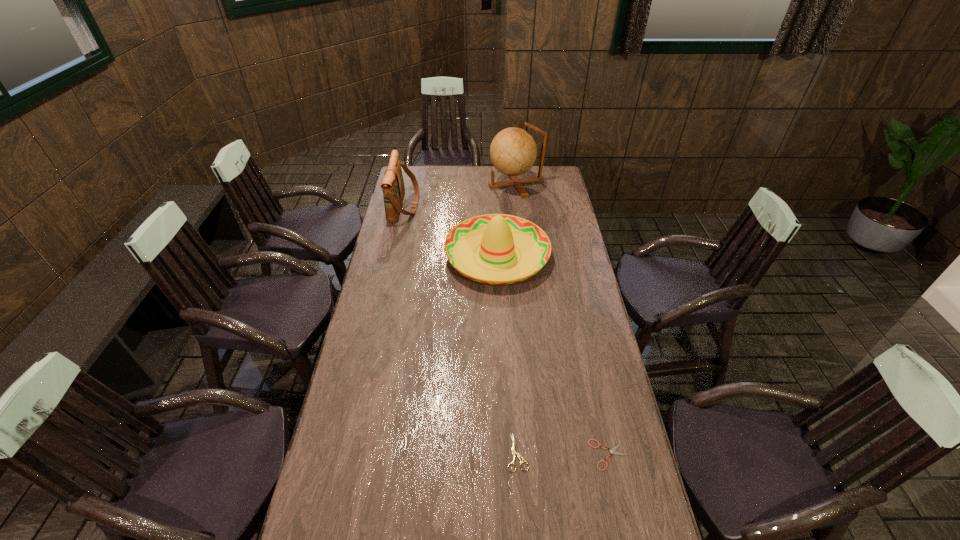
You are a GUI agent. You are given a task and a screenshot of the screen. Output one action in this format:
    pyautogui.click(x=<x>, y=<y>)
    Task: Click on the free point located on the front-facing side of the shoulder bag
    
    Given the screenshot: What is the action you would take?
    pyautogui.click(x=468, y=205)

Find the location of a particular element. The height and width of the screenshot is (540, 960). vacant space situated 0.100m on the right of the sombrero is located at coordinates (571, 255).

This screenshot has width=960, height=540. In order to click on free space located 0.140m on the front of the left shears in this screenshot , I will do `click(522, 526)`.

You are a GUI agent. You are given a task and a screenshot of the screen. Output one action in this format:
    pyautogui.click(x=<x>, y=<y>)
    Task: Click on the vacant space positioned 0.110m on the front of the shorter shears
    The image size is (960, 540).
    Given the screenshot: What is the action you would take?
    (x=620, y=511)

In order to click on globe situated at the far edge in this screenshot , I will do `click(513, 151)`.

At what (x,y) coordinates should I click in order to perform the action: click on shoulder bag located in the far edge section of the desktop. Please return your answer as a coordinate pair (x, y). Looking at the image, I should click on click(392, 184).

Locate an element on the screen. The image size is (960, 540). object positioned at the left edge is located at coordinates (392, 184).

Identify the location of globe that is at the right edge. (x=513, y=151).

In order to click on sombrero present at the right edge in this screenshot , I will do `click(501, 237)`.

In order to click on shears located in the right edge section of the desktop in this screenshot , I will do `click(612, 451)`.